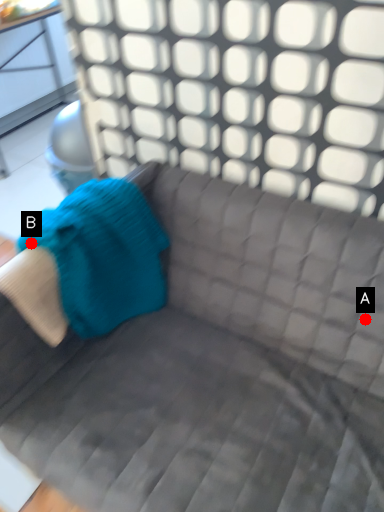
Question: Two points are circled on the image, labeled by A and B beside each circle. Which point is farther from the camera taking this photo?

Choices:
 (A) A is further
 (B) B is further

Answer: (A)